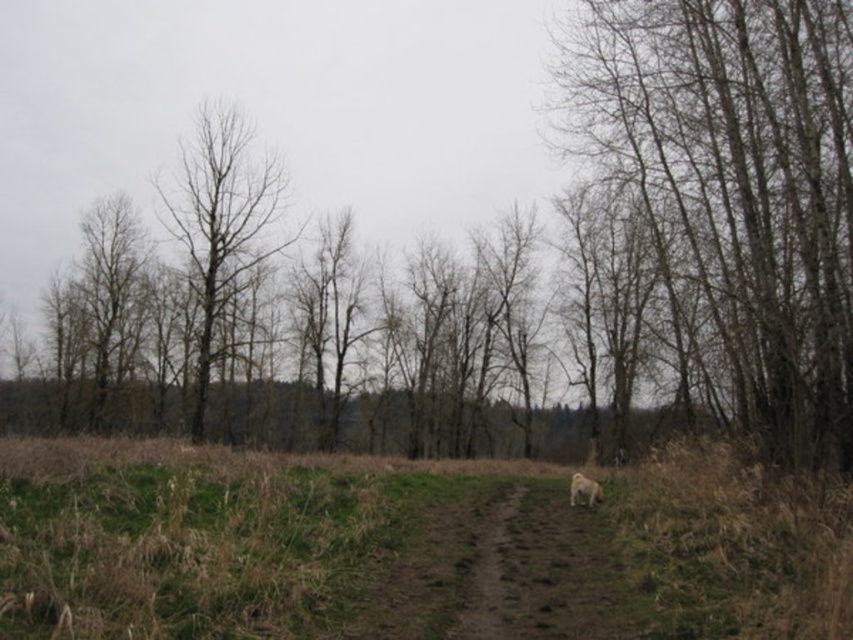
You are a gardener planning to mow the green grass at lower center and trim the bare wood trees at right. Which task requires more attention to their relative sizes?

The green grass at lower center has a smaller size compared to the bare wood trees at right, so trimming the bare wood trees at right requires more attention due to their larger size.

You are standing on the dirt path in the rural landscape. You notice two points marked in the image. The first point is at coordinates point [785,232] and the second is at point [572,480]. If you want to reach the point that is closer to you, which one should you head towards?

You should head towards point [785,232] because it is closer to the viewer than point [572,480] according to the description.